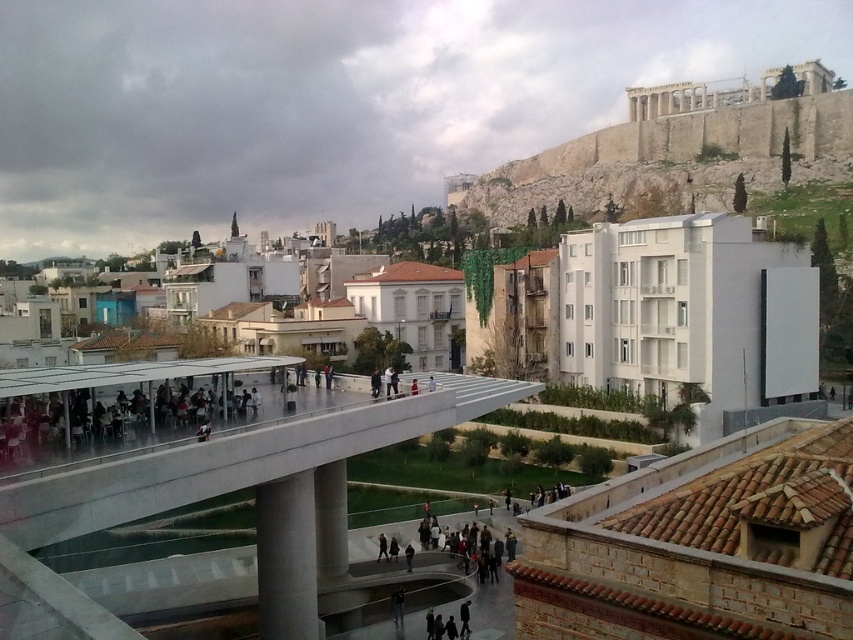
Looking at this image, you are standing at point (212,497) in the cityscape. What structure are you currently on?

You are on the white concrete overpass at center located at point (212,497).

Based on the photo, you are a maintenance worker needing to inspect both the white concrete overpass at center and the white concrete pillar at center. Which one do you need to climb up to reach first?

The white concrete overpass at center is above the white concrete pillar at center, so you need to climb up to the white concrete pillar at center first before reaching the overpass.